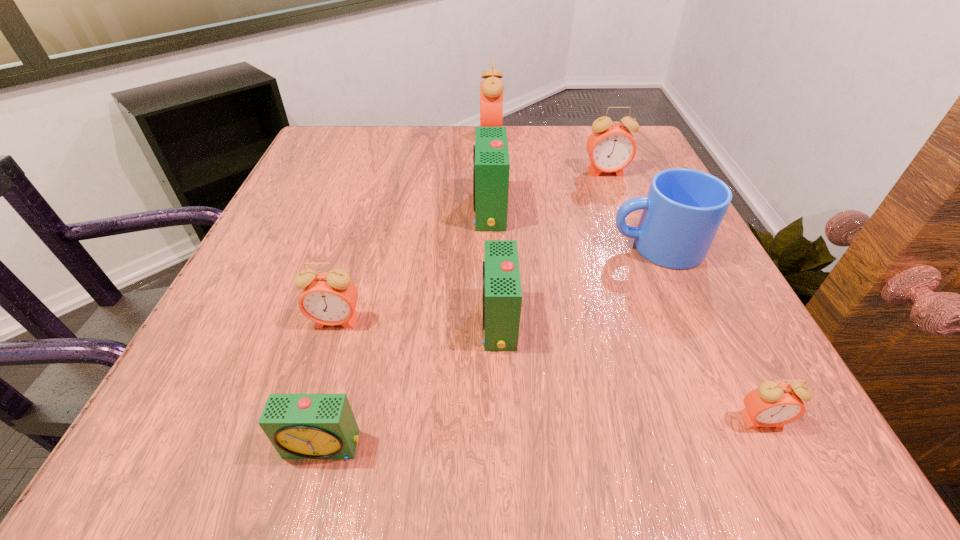
Find the location of a particular element. This screenshot has height=540, width=960. vacant space positioned on the front-facing side of the third farthest alarm clock is located at coordinates (355, 211).

The image size is (960, 540). Identify the location of free space located on the side of the mug with the handle. [x=500, y=247].

At what (x,y) coordinates should I click in order to perform the action: click on free region located on the side of the mug with the handle. Please return your answer as a coordinate pair (x, y). The height and width of the screenshot is (540, 960). Looking at the image, I should click on (424, 247).

You are a GUI agent. You are given a task and a screenshot of the screen. Output one action in this format:
    pyautogui.click(x=<x>, y=<y>)
    Task: Click on the vacant region located on the side of the mug with the handle
    
    Given the screenshot: What is the action you would take?
    pyautogui.click(x=413, y=247)

Locate an element on the screen. This screenshot has width=960, height=540. vacant region located on the front-facing side of the second farthest green alarm clock is located at coordinates (327, 322).

I want to click on vacant position located on the front-facing side of the second farthest green alarm clock, so click(347, 322).

This screenshot has height=540, width=960. What are the coordinates of `vacant space located 0.330m on the front-facing side of the second farthest green alarm clock` in the screenshot? It's located at (269, 322).

The height and width of the screenshot is (540, 960). I want to click on object that is positioned at the left edge, so tap(330, 298).

This screenshot has width=960, height=540. Find the location of `mug situated at the right edge`. mug situated at the right edge is located at coordinates (682, 212).

You are a GUI agent. You are given a task and a screenshot of the screen. Output one action in this format:
    pyautogui.click(x=<x>, y=<y>)
    Task: Click on the object that is positioned at the far right corner
    This screenshot has width=960, height=540.
    Given the screenshot: What is the action you would take?
    pyautogui.click(x=611, y=147)